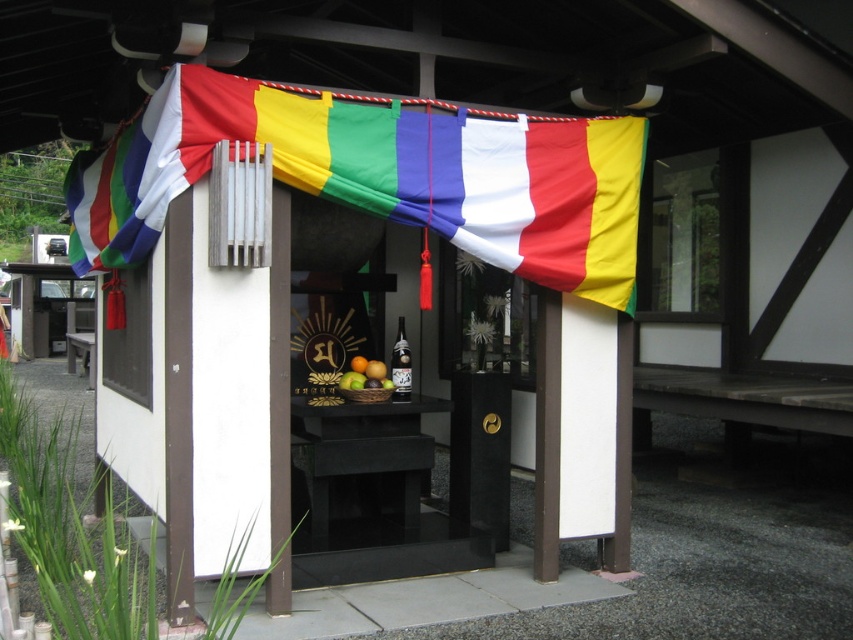
You are a visitor at the shrine and want to place an offering in the glossy wooden bowl at center. The banner is fluttering in the wind. Can you reach the bowl without touching the multicolored fabric banner at upper center?

The distance between the multicolored fabric banner at upper center and the glossy wooden bowl at center is 4.66 feet. Since the banner is above the bowl, you can safely reach the bowl without touching the banner as they are separated by this distance.

You are an architect designing a model of this shrine. You need to place both the multicolored fabric banner at upper center and the glossy wooden bowl at center accurately. Which object should you make wider in your model?

The multicolored fabric banner at upper center should be made wider in the model since its width surpasses that of the glossy wooden bowl at center.

You are standing at the entrance of a traditional Japanese shrine. You want to take a photo of the point located at coordinate point (165, 134). The camera you are using has a focal length of 50mm and a sensor size of 24mm x 36mm. What is the minimum distance you need to move forward to ensure the point is within the camera frame?

The point at coordinate point (165, 134) is 12.94 feet away from the camera. To ensure the point is within the camera frame, you need to move forward until the distance between you and the point is less than or equal to 12.94 feet.